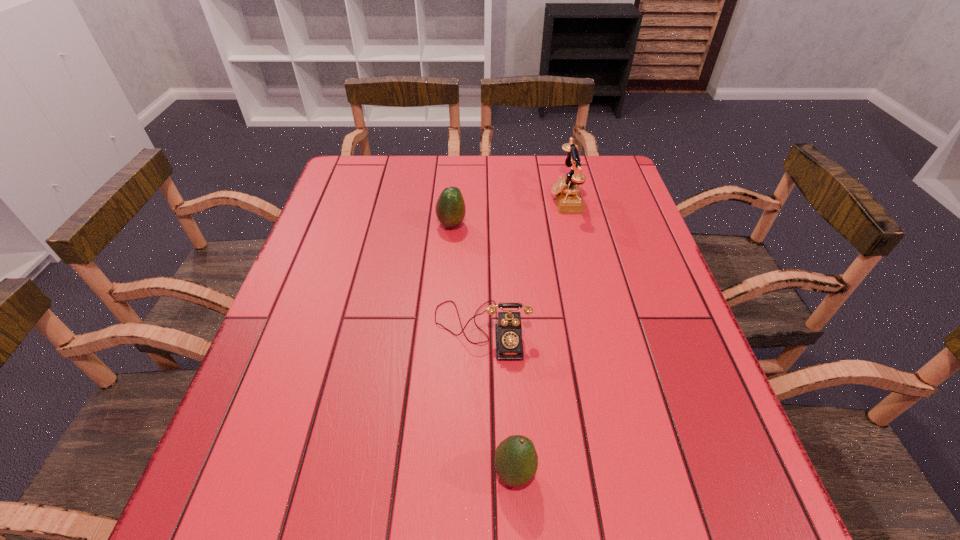
Find the location of a particular element. The height and width of the screenshot is (540, 960). the right telephone is located at coordinates (x=566, y=190).

Identify the location of the rightmost object. The height and width of the screenshot is (540, 960). (566, 190).

In order to click on the farther avocado in this screenshot , I will do `click(450, 209)`.

I want to click on the right avocado, so click(516, 461).

This screenshot has width=960, height=540. What are the coordinates of `the nearer avocado` in the screenshot? It's located at (516, 461).

Locate an element on the screen. Image resolution: width=960 pixels, height=540 pixels. the shorter telephone is located at coordinates (508, 332).

Find the location of `the second nearest object`. the second nearest object is located at coordinates (508, 332).

Find the location of a particular element. vacant position located on the dial of the tallest object is located at coordinates (503, 198).

You are a GUI agent. You are given a task and a screenshot of the screen. Output one action in this format:
    pyautogui.click(x=<x>, y=<y>)
    Task: Click on the free space located on the dial of the tallest object
    
    Given the screenshot: What is the action you would take?
    pos(530,198)

I want to click on blank space located on the dial of the tallest object, so click(513, 198).